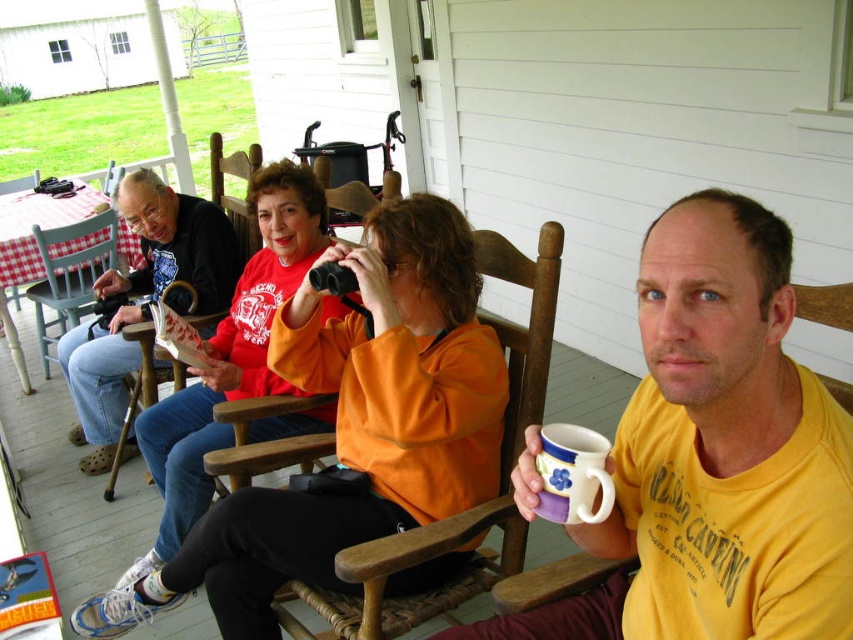
Question: Which of these objects is positioned farthest from the yellow matte t-shirt at center?

Choices:
 (A) matte purple mug at lower right
 (B) wooden chair at left
 (C) light blue wooden chair at left

Answer: (C)

Question: Estimate the real-world distances between objects in this image. Which object is closer to the matte black jacket at left?

Choices:
 (A) matte purple mug at lower right
 (B) light blue wooden chair at left

Answer: (B)

Question: Is matte black jacket at left above wooden chair at left?

Choices:
 (A) yes
 (B) no

Answer: (A)

Question: Can you confirm if matte purple mug at lower right is positioned to the left of wooden chair at left?

Choices:
 (A) yes
 (B) no

Answer: (B)

Question: Is the position of yellow matte t-shirt at center more distant than that of matte black jacket at left?

Choices:
 (A) no
 (B) yes

Answer: (A)

Question: Which of the following is the farthest from the observer?

Choices:
 (A) wooden chair at left
 (B) light blue wooden chair at left
 (C) matte purple mug at lower right

Answer: (B)